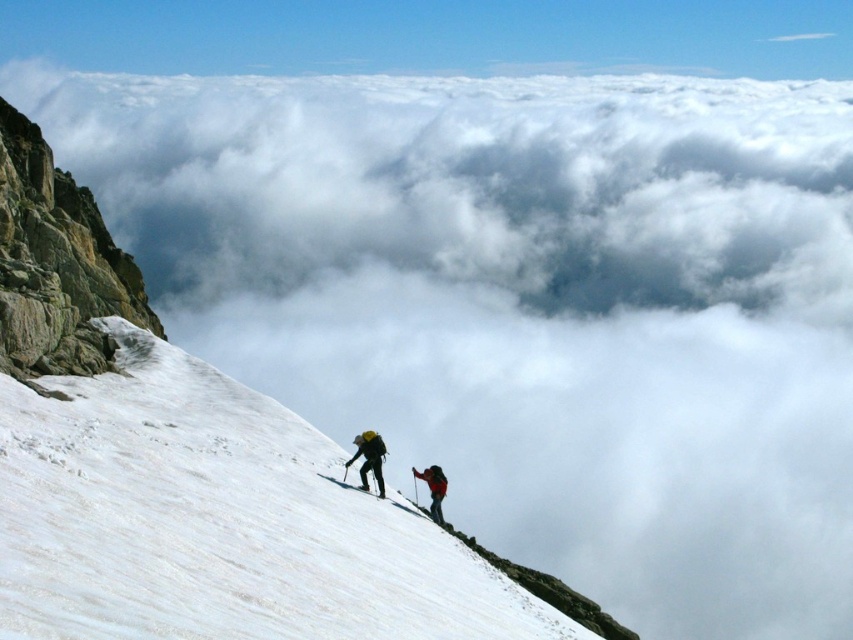
Is red fabric backpack at center further to camera compared to black matte ski at lower center?

Yes, red fabric backpack at center is further from the viewer.

Identify the location of red fabric backpack at center. (433, 490).

Does matte black backpack at center have a lesser height compared to white matte ski at lower center?

No, matte black backpack at center is not shorter than white matte ski at lower center.

Who is higher up, matte black backpack at center or white matte ski at lower center?

matte black backpack at center is above.

Describe the element at coordinates (369, 458) in the screenshot. I see `matte black backpack at center` at that location.

Where is `matte black backpack at center`? matte black backpack at center is located at coordinates (369, 458).

Who is shorter, matte black backpack at center or black matte ski at lower center?

With less height is black matte ski at lower center.

The width and height of the screenshot is (853, 640). What are the coordinates of `matte black backpack at center` in the screenshot? It's located at (369, 458).

Locate an element on the screen. This screenshot has height=640, width=853. matte black backpack at center is located at coordinates (369, 458).